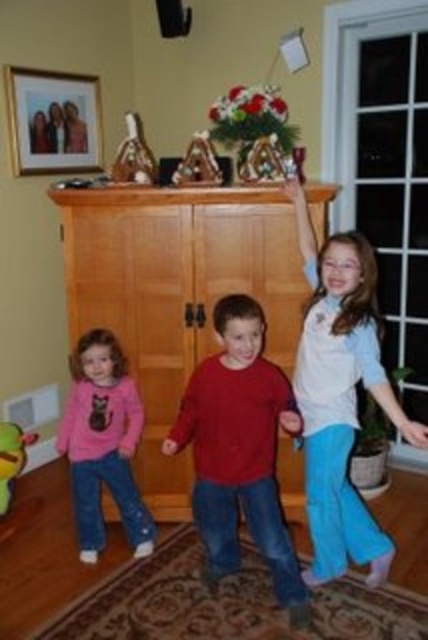
Question: Can you confirm if red matte sweater at center is positioned above metallic triangular ornament at center?

Choices:
 (A) yes
 (B) no

Answer: (B)

Question: Which point appears closest to the camera in this image?

Choices:
 (A) (58, 116)
 (B) (216, 184)
 (C) (258, 541)

Answer: (C)

Question: Is matte wooden picture frame at upper left to the left of shiny chocolate candy at center from the viewer's perspective?

Choices:
 (A) yes
 (B) no

Answer: (A)

Question: Is red matte sweater at center in front of shiny chocolate candy at center?

Choices:
 (A) yes
 (B) no

Answer: (A)

Question: Which point is farther to the camera?

Choices:
 (A) white cotton shirt at upper right
 (B) metallic triangular ornament at center
 (C) red matte sweater at center
 (D) shiny chocolate candy at center

Answer: (D)

Question: Considering the real-world distances, which object is farthest from the pink soft fabric shirt at lower left?

Choices:
 (A) red matte sweater at center
 (B) rubber duck at lower left

Answer: (B)